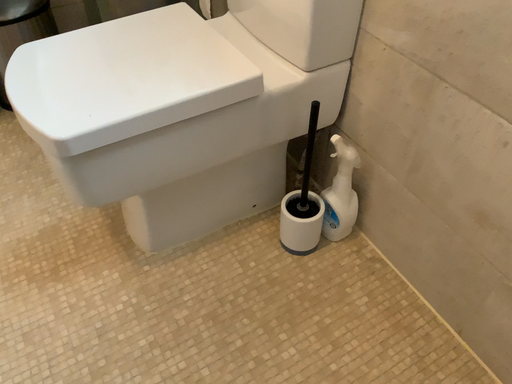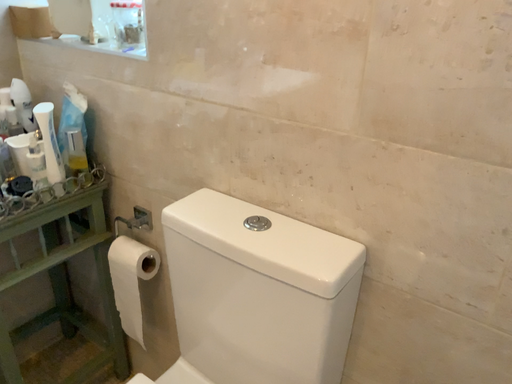
Question: How did the camera likely rotate when shooting the video?

Choices:
 (A) rotated downward
 (B) rotated upward

Answer: (B)